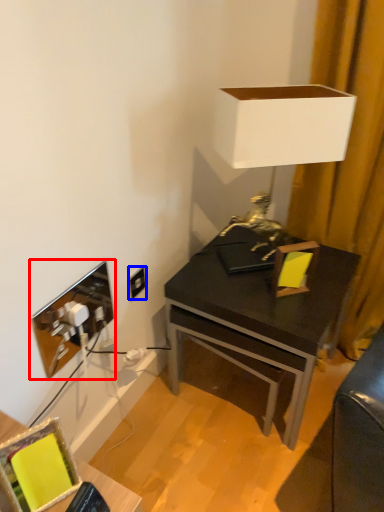
Question: Which of the following is the farthest to the observer, picture frame (highlighted by a red box) or power outlet (highlighted by a blue box)?

Choices:
 (A) picture frame
 (B) power outlet

Answer: (B)